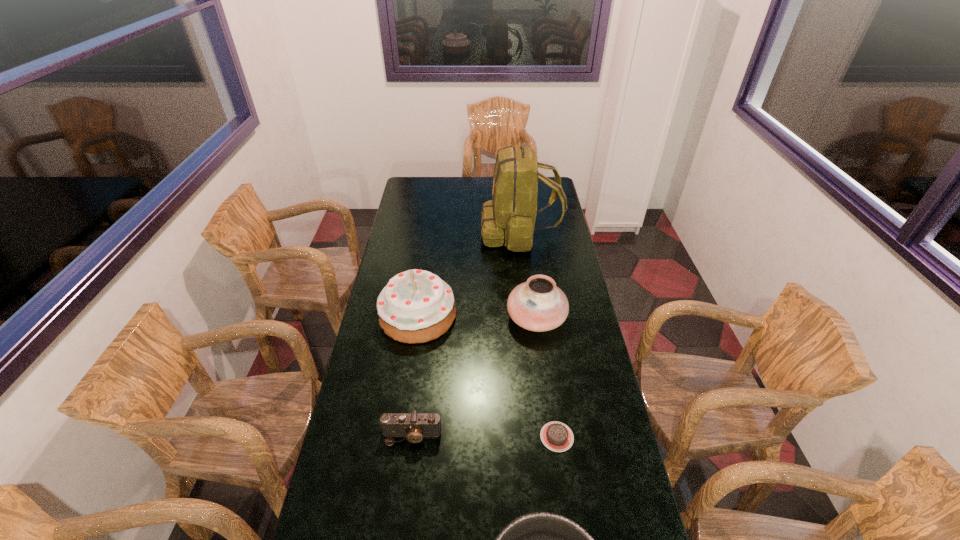
The height and width of the screenshot is (540, 960). Identify the location of vacant space located on the front of the pottery. (544, 382).

At what (x,y) coordinates should I click in order to perform the action: click on vacant space located 0.140m on the front-facing side of the camera. Please return your answer as a coordinate pair (x, y). Looking at the image, I should click on (404, 495).

Where is `free space located on the back of the shortest object`? free space located on the back of the shortest object is located at coordinates (542, 333).

This screenshot has height=540, width=960. Identify the location of cake located at the left edge. (416, 306).

Locate an element on the screen. camera present at the left edge is located at coordinates (414, 426).

You are a GUI agent. You are given a task and a screenshot of the screen. Output one action in this format:
    pyautogui.click(x=<x>, y=<y>)
    Task: Click on the backpack that is at the right edge
    The image size is (960, 540).
    Given the screenshot: What is the action you would take?
    pos(510,217)

Identify the location of pottery that is at the right edge. The height and width of the screenshot is (540, 960). (538, 305).

Where is `chocolate cake present at the right edge`? chocolate cake present at the right edge is located at coordinates (556, 436).

The image size is (960, 540). I want to click on free region at the far edge of the desktop, so click(469, 197).

The width and height of the screenshot is (960, 540). I want to click on blank space at the left edge of the desktop, so click(x=357, y=376).